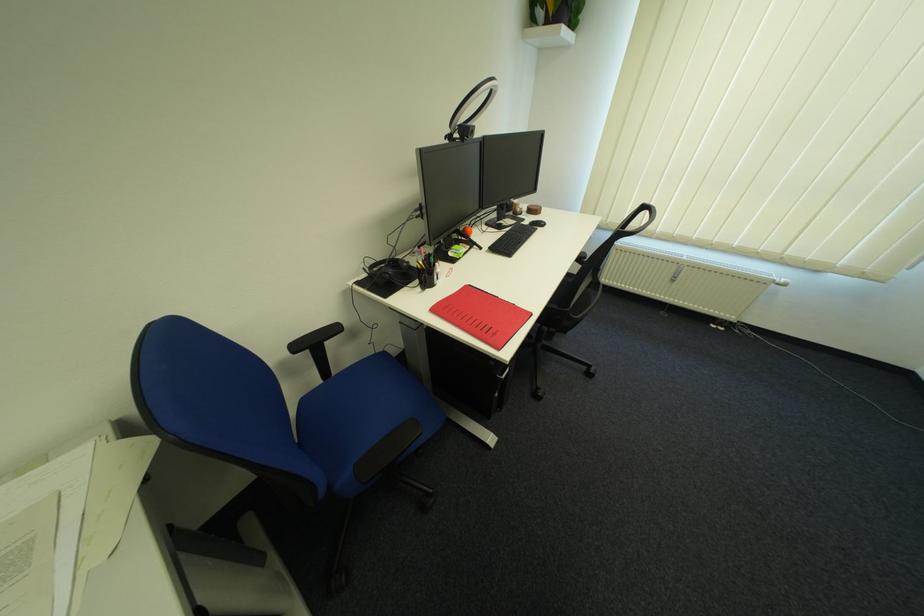
Describe the element at coordinates (786, 278) in the screenshot. I see `the radiator valve` at that location.